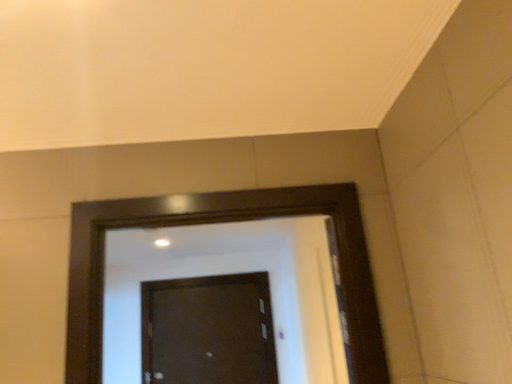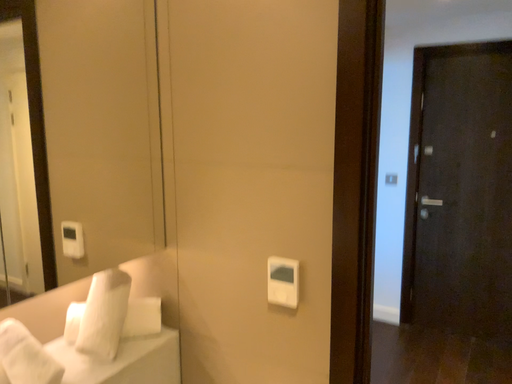
Question: Which way did the camera rotate in the video?

Choices:
 (A) rotated downward
 (B) rotated upward

Answer: (A)